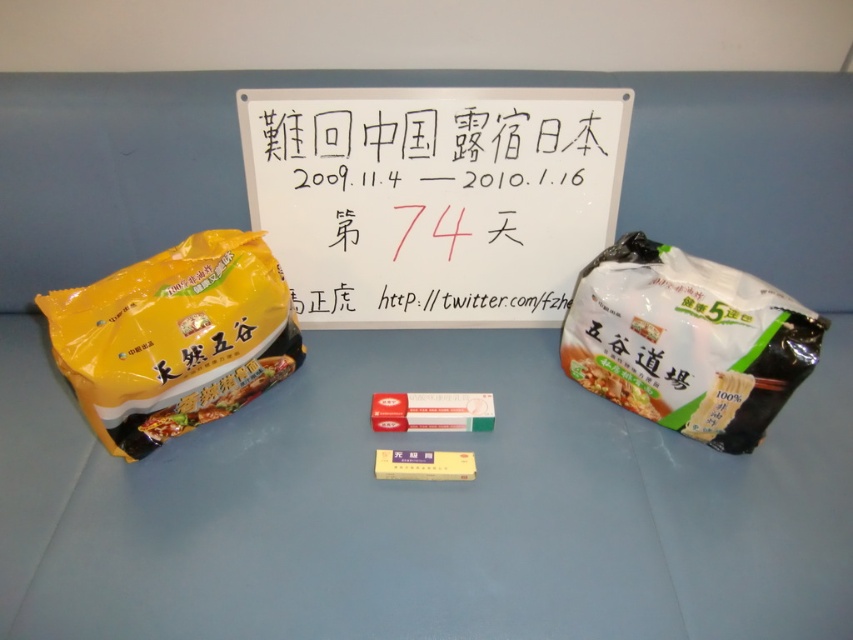
You are standing in front of the white rectangular board with Chinese text and dates. There are two points marked on the setup. Which point is closer to you, point at coordinates (554, 164) or point at coordinates (294, 332)?

Point at coordinates (554, 164) is closer to you than point at coordinates (294, 332) because it is further to the viewer according to the description.

You are organizing a small exhibition and need to place the blue matte table at center and the white paperboard at center on a display stand. Given their sizes, which object should be placed first to ensure proper alignment?

The blue matte table at center should be placed first because its width is greater than the white paperboard at center, allowing for proper alignment based on size differences.

You are organizing a small exhibition and need to place a decorative item between the blue matte table at center and the white paperboard at center. Based on their positions, where should you place the item to ensure it is centered between them?

The blue matte table at center is positioned on the left side of white paperboard at center, so placing the decorative item halfway between them would require positioning it to the right of the blue matte table at center and to the left of the white paperboard at center, ensuring it is centered between both objects.